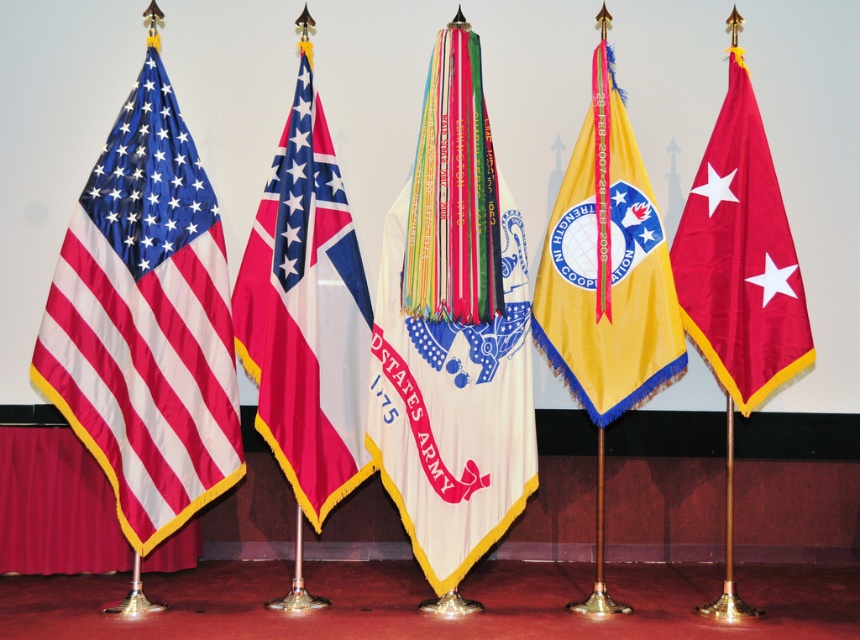
You are a flag arranger who needs to place a new flag between the matte fabric flag at left and the polyester flag at center. The new flag must be exactly halfway between them. What is the minimum distance you need to move either flag to create space?

The matte fabric flag at left and polyester flag at center are 13.21 inches apart. To place a new flag exactly halfway between them, you would need to move either flag by at least 6.605 inches to create the necessary space.

You are standing in front of five flags arranged in a row against a plain white backdrop. You notice a point marked at coordinates (146, 321). Which flag is this point located on?

The point at coordinates (146, 321) corresponds to the matte fabric flag at left.

You are a flag designer who needs to ensure proper visibility of all flags in a display. Given that the polyester flag at center and the yellow fabric flag at center are both at the center, which flag would be more visible from a distance? Please explain your reasoning based on their sizes.

The polyester flag at center is much taller than the yellow fabric flag at center, making it more visible from a distance due to its larger size.